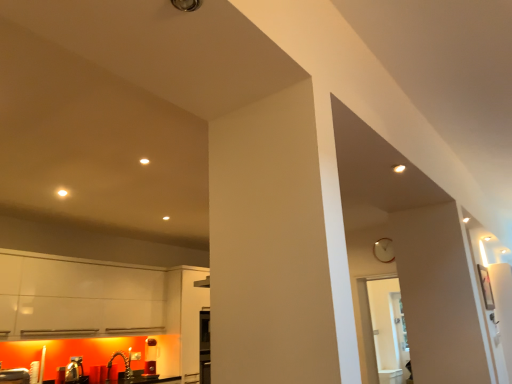
Question: Does wooden clock at upper right appear on the right side of brushed metal sink at lower left?

Choices:
 (A) no
 (B) yes

Answer: (B)

Question: From the image's perspective, is wooden clock at upper right under brushed metal sink at lower left?

Choices:
 (A) no
 (B) yes

Answer: (A)

Question: Does wooden clock at upper right turn towards brushed metal sink at lower left?

Choices:
 (A) yes
 (B) no

Answer: (B)

Question: Would you say brushed metal sink at lower left is part of wooden clock at upper right's contents?

Choices:
 (A) no
 (B) yes

Answer: (A)

Question: Is wooden clock at upper right behind brushed metal sink at lower left?

Choices:
 (A) yes
 (B) no

Answer: (A)

Question: Relative to wooden clock at upper right, is transparent glass door at center in front or behind?

Choices:
 (A) front
 (B) behind

Answer: (A)

Question: From the image's perspective, is transparent glass door at center above or below wooden clock at upper right?

Choices:
 (A) above
 (B) below

Answer: (B)

Question: Is transparent glass door at center bigger or smaller than wooden clock at upper right?

Choices:
 (A) small
 (B) big

Answer: (B)

Question: Is transparent glass door at center inside or outside of wooden clock at upper right?

Choices:
 (A) inside
 (B) outside

Answer: (B)

Question: Considering the positions of brushed metal sink at lower left and transparent glass door at center in the image, is brushed metal sink at lower left taller or shorter than transparent glass door at center?

Choices:
 (A) short
 (B) tall

Answer: (A)

Question: Would you say brushed metal sink at lower left is to the left or to the right of transparent glass door at center in the picture?

Choices:
 (A) right
 (B) left

Answer: (B)

Question: Is brushed metal sink at lower left wider or thinner than transparent glass door at center?

Choices:
 (A) wide
 (B) thin

Answer: (B)

Question: Is point (56, 377) closer or farther from the camera than point (382, 319)?

Choices:
 (A) closer
 (B) farther

Answer: (A)

Question: Is point (376, 244) positioned closer to the camera than point (381, 367)?

Choices:
 (A) farther
 (B) closer

Answer: (B)

Question: Would you say wooden clock at upper right is to the left or to the right of transparent glass door at center in the picture?

Choices:
 (A) right
 (B) left

Answer: (A)